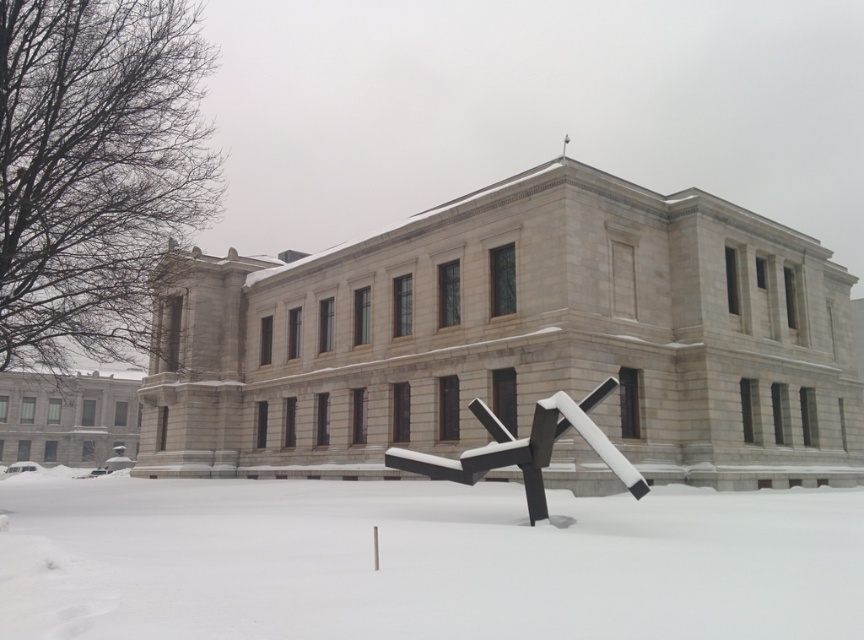
Question: Can you confirm if white powdery snow at center is bigger than black matte sculpture at center?

Choices:
 (A) no
 (B) yes

Answer: (B)

Question: Is white powdery snow at center positioned behind black matte sculpture at center?

Choices:
 (A) no
 (B) yes

Answer: (A)

Question: Which object is farther from the camera taking this photo?

Choices:
 (A) white powdery snow at center
 (B) black matte sculpture at center

Answer: (B)

Question: Is white powdery snow at center below black matte sculpture at center?

Choices:
 (A) no
 (B) yes

Answer: (B)

Question: Among these points, which one is farthest from the camera?

Choices:
 (A) (402, 468)
 (B) (719, 497)

Answer: (B)

Question: Which object appears closest to the camera in this image?

Choices:
 (A) black matte sculpture at center
 (B) white powdery snow at center

Answer: (B)